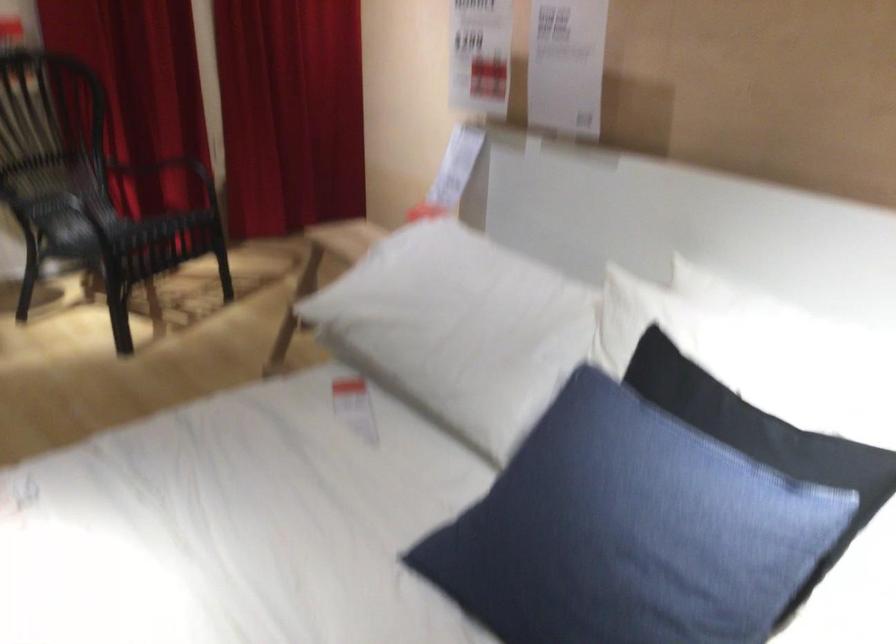
Find the location of a particular element. chair armrest is located at coordinates (176, 169).